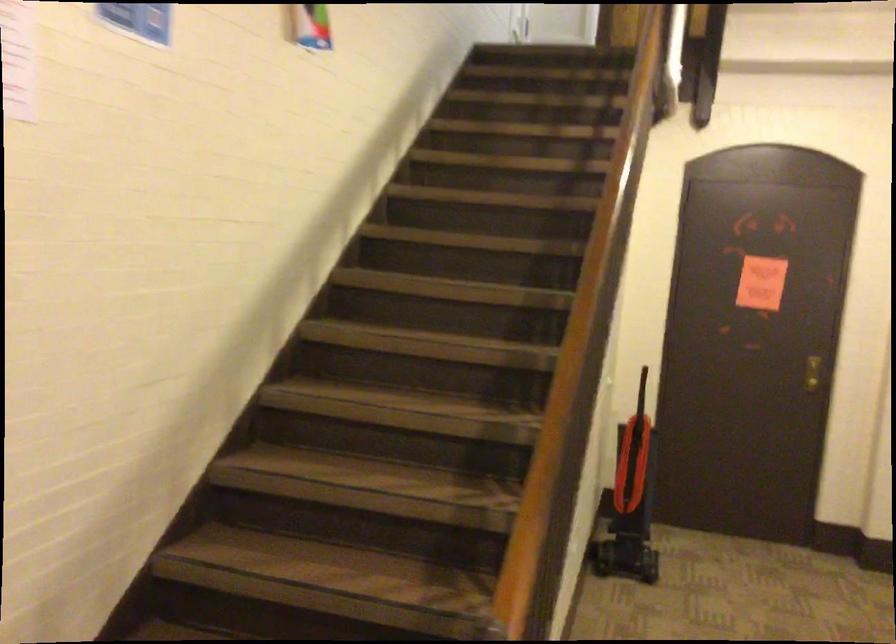
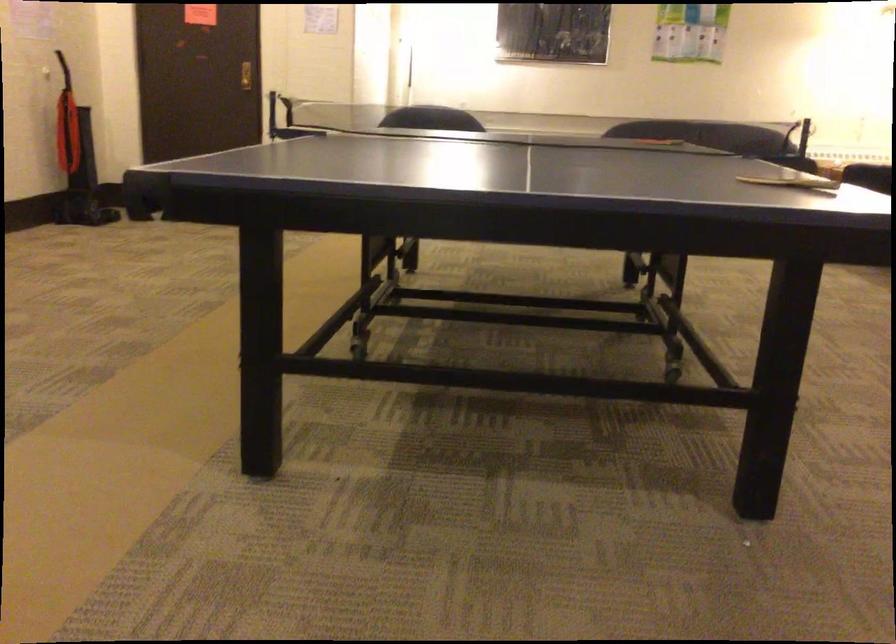
The images are taken continuously from a first-person perspective. In which direction are you moving?

The cameraman moved toward right, backward.